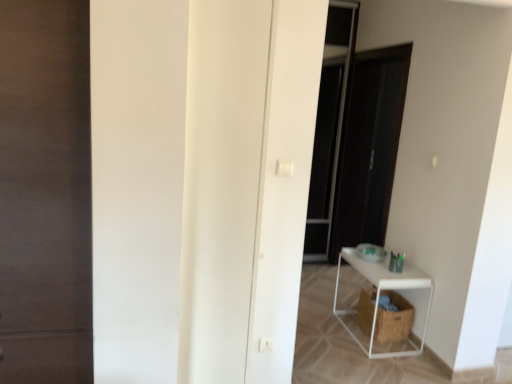
Question: Considering the relative sizes of white matte shelf at lower right and dark wood door at left, which appears as the first door when viewed from the left, in the image provided, is white matte shelf at lower right taller than dark wood door at left, which appears as the first door when viewed from the left,?

Choices:
 (A) no
 (B) yes

Answer: (A)

Question: From a real-world perspective, is white matte shelf at lower right located beneath dark wood door at left, which appears as the first door when viewed from the left?

Choices:
 (A) yes
 (B) no

Answer: (A)

Question: Is white matte shelf at lower right closer to camera compared to dark wood door at left, which appears as the 2th door when viewed from the right?

Choices:
 (A) yes
 (B) no

Answer: (B)

Question: Can dark wood door at left, which appears as the 2th door when viewed from the right, be found inside white matte shelf at lower right?

Choices:
 (A) no
 (B) yes

Answer: (A)

Question: Does white matte shelf at lower right lie behind dark wood door at left, which appears as the first door when viewed from the left?

Choices:
 (A) yes
 (B) no

Answer: (A)

Question: Is point (371, 183) closer or farther from the camera than point (393, 274)?

Choices:
 (A) farther
 (B) closer

Answer: (A)

Question: Considering their positions, is transparent glass screen door at center located in front of or behind white matte shelf at lower right?

Choices:
 (A) front
 (B) behind

Answer: (B)

Question: Would you say transparent glass screen door at center is inside or outside white matte shelf at lower right?

Choices:
 (A) inside
 (B) outside

Answer: (B)

Question: Is transparent glass screen door at center wider or thinner than white matte shelf at lower right?

Choices:
 (A) wide
 (B) thin

Answer: (B)

Question: Considering the positions of white matte shelf at lower right and white matte door at center, the 1th door in the right-to-left sequence, in the image, is white matte shelf at lower right wider or thinner than white matte door at center, the 1th door in the right-to-left sequence,?

Choices:
 (A) thin
 (B) wide

Answer: (B)

Question: Does point (397, 276) appear closer or farther from the camera than point (184, 274)?

Choices:
 (A) closer
 (B) farther

Answer: (B)

Question: From the image's perspective, is white matte shelf at lower right located above or below white matte door at center, the 2th door positioned from the left?

Choices:
 (A) above
 (B) below

Answer: (B)

Question: From their relative heights in the image, would you say white matte shelf at lower right is taller or shorter than white matte door at center, the 2th door positioned from the left?

Choices:
 (A) short
 (B) tall

Answer: (A)

Question: From the image's perspective, relative to brown woven laundry basket at lower right, is white matte door at center, the 2th door positioned from the left, above or below?

Choices:
 (A) below
 (B) above

Answer: (B)

Question: Is white matte door at center, the 1th door in the right-to-left sequence, inside or outside of brown woven laundry basket at lower right?

Choices:
 (A) inside
 (B) outside

Answer: (B)